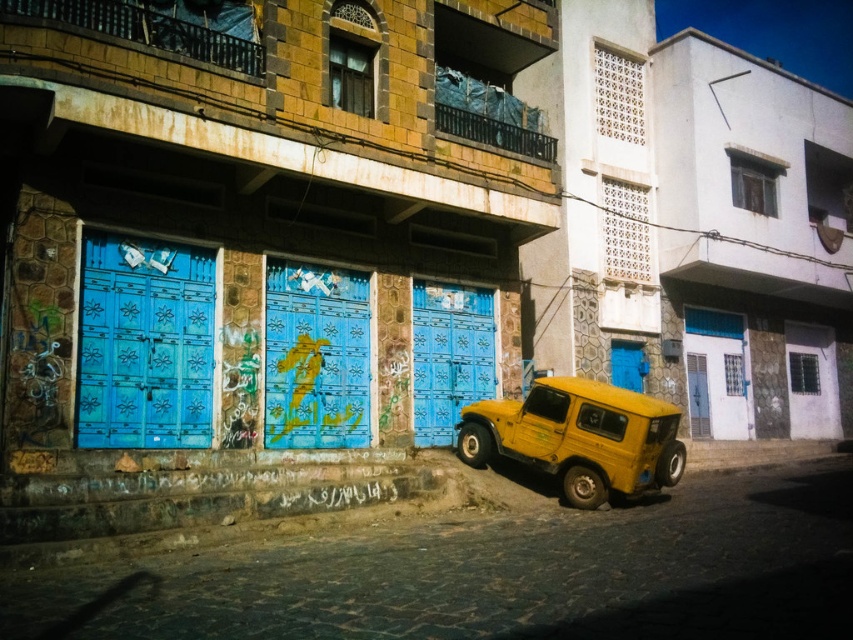
Question: Does blue carved wood door at left have a lesser width compared to blue painted wooden door at center?

Choices:
 (A) yes
 (B) no

Answer: (A)

Question: Which point is closer to the camera?

Choices:
 (A) (167, 400)
 (B) (583, 397)
 (C) (350, 413)

Answer: (A)

Question: Is blue carved wood door at left to the right of blue painted wood door at center from the viewer's perspective?

Choices:
 (A) no
 (B) yes

Answer: (A)

Question: Does yellow matte pickup truck at center appear under blue painted wooden door at center?

Choices:
 (A) yes
 (B) no

Answer: (A)

Question: Which of the following is the closest to the observer?

Choices:
 (A) blue painted wood door at center
 (B) blue painted wooden door at center

Answer: (B)

Question: Which object is farther from the camera taking this photo?

Choices:
 (A) yellow matte pickup truck at center
 (B) blue painted wood door at center

Answer: (B)